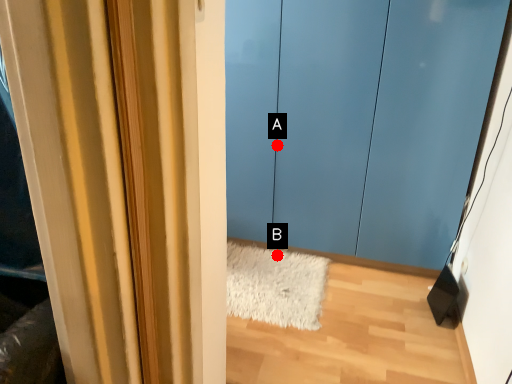
Question: Two points are circled on the image, labeled by A and B beside each circle. Which point appears closest to the camera in this image?

Choices:
 (A) A is closer
 (B) B is closer

Answer: (A)